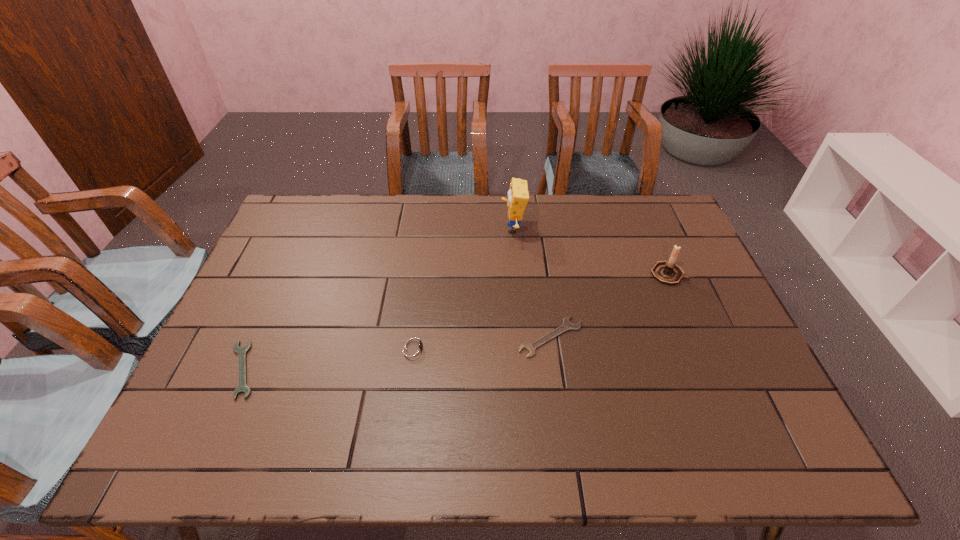
Where is `free point located on the face of the farthest object`? free point located on the face of the farthest object is located at coordinates (442, 228).

You are a GUI agent. You are given a task and a screenshot of the screen. Output one action in this format:
    pyautogui.click(x=<x>, y=<y>)
    Task: Click on the vacant space located 0.320m on the back of the rightmost object
    The height and width of the screenshot is (540, 960).
    Given the screenshot: What is the action you would take?
    pyautogui.click(x=636, y=203)

The width and height of the screenshot is (960, 540). I want to click on vacant position located 0.230m on the face of the third shortest object, so 523,348.

This screenshot has height=540, width=960. Identify the location of vacant space situated on the front of the right wrench. (564, 437).

At what (x,y) coordinates should I click in order to perform the action: click on free space located 0.060m on the back of the left wrench. Please return your answer as a coordinate pair (x, y). Looking at the image, I should click on (263, 324).

Locate an element on the screen. object positioned at the far edge is located at coordinates (518, 195).

At what (x,y) coordinates should I click in order to perform the action: click on object that is at the left edge. Please return your answer as a coordinate pair (x, y). Image resolution: width=960 pixels, height=540 pixels. Looking at the image, I should click on (242, 387).

Where is `object situated at the right edge`? The width and height of the screenshot is (960, 540). object situated at the right edge is located at coordinates (667, 272).

The image size is (960, 540). I want to click on blank area at the far edge, so click(540, 211).

Locate an element on the screen. The width and height of the screenshot is (960, 540). vacant space at the near edge of the desktop is located at coordinates (285, 427).